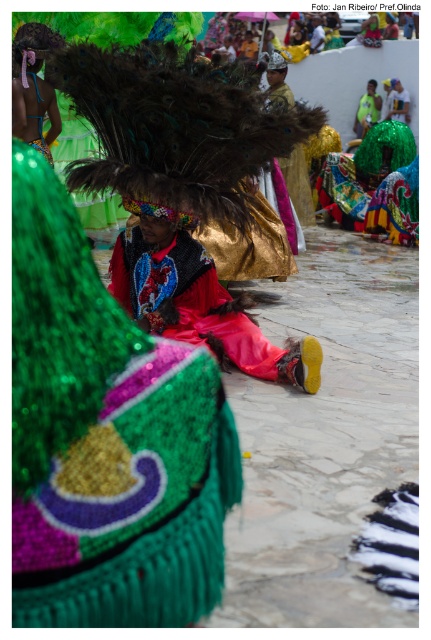
Question: Does shiny sequined headdress at upper left appear over shiny metallic mask at upper left?

Choices:
 (A) yes
 (B) no

Answer: (A)

Question: Which object is the closest to the shiny metallic mask at upper left?

Choices:
 (A) shiny sequined headdress at upper left
 (B) shiny sequined skirt at center
 (C) shiny sequined costume at center

Answer: (A)

Question: Is shiny sequined skirt at center bigger than shiny sequined headdress at upper left?

Choices:
 (A) no
 (B) yes

Answer: (A)

Question: Among these objects, which one is nearest to the camera?

Choices:
 (A) shiny metallic mask at upper left
 (B) shiny sequined headdress at upper left
 (C) shiny sequined costume at center
 (D) shiny sequined skirt at center

Answer: (D)

Question: Observing the image, what is the correct spatial positioning of shiny sequined costume at center in reference to shiny metallic mask at upper left?

Choices:
 (A) above
 (B) below

Answer: (B)

Question: Which object is the closest to the shiny sequined skirt at center?

Choices:
 (A) shiny sequined headdress at upper left
 (B) shiny sequined costume at center

Answer: (B)